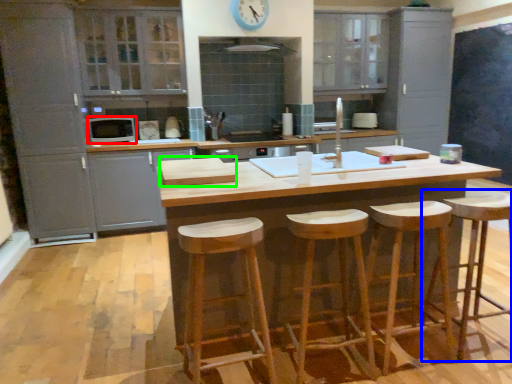
Question: Based on their relative distances, which object is farther from appliance (highlighted by a red box)? Choose from bar stool (highlighted by a blue box) and wood (highlighted by a green box).

Choices:
 (A) bar stool
 (B) wood

Answer: (A)